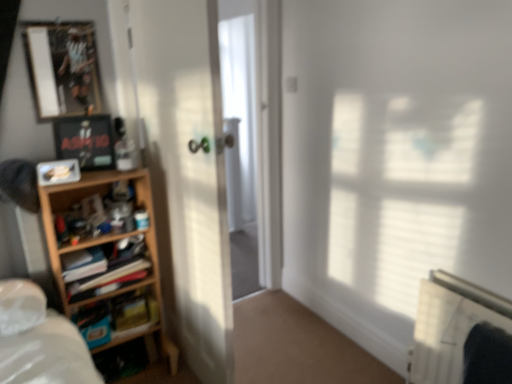
Question: From a real-world perspective, is metallic silver picture frame at upper left, the third picture frame positioned from the bottom, positioned over matte black picture frame at upper left, the second picture frame positioned from the bottom, based on gravity?

Choices:
 (A) no
 (B) yes

Answer: (B)

Question: Would you say metallic silver picture frame at upper left, the third picture frame positioned from the bottom, is outside matte black picture frame at upper left, the second picture frame positioned from the bottom?

Choices:
 (A) no
 (B) yes

Answer: (B)

Question: Does metallic silver picture frame at upper left, the first picture frame viewed from the top, appear on the right side of matte black picture frame at upper left, acting as the 2th picture frame starting from the top?

Choices:
 (A) no
 (B) yes

Answer: (A)

Question: Is matte black picture frame at upper left, the second picture frame positioned from the bottom, completely or partially inside metallic silver picture frame at upper left, the first picture frame viewed from the top?

Choices:
 (A) yes
 (B) no

Answer: (B)

Question: Is metallic silver picture frame at upper left, the first picture frame viewed from the top, turned away from matte black picture frame at upper left, acting as the 2th picture frame starting from the top?

Choices:
 (A) yes
 (B) no

Answer: (B)

Question: Is the position of metallic silver picture frame at upper left, the third picture frame positioned from the bottom, more distant than that of matte black picture frame at upper left, acting as the 2th picture frame starting from the top?

Choices:
 (A) no
 (B) yes

Answer: (A)

Question: Is the position of metallic silver picture frame at upper left, the first picture frame viewed from the top, more distant than that of matte plastic picture frame at left, which ranks as the third picture frame in top-to-bottom order?

Choices:
 (A) no
 (B) yes

Answer: (B)

Question: From a real-world perspective, is metallic silver picture frame at upper left, the third picture frame positioned from the bottom, beneath matte plastic picture frame at left, the 1th picture frame positioned from the bottom?

Choices:
 (A) yes
 (B) no

Answer: (B)

Question: Is metallic silver picture frame at upper left, the first picture frame viewed from the top, not close to matte plastic picture frame at left, which ranks as the third picture frame in top-to-bottom order?

Choices:
 (A) no
 (B) yes

Answer: (A)

Question: From the image's perspective, would you say metallic silver picture frame at upper left, the first picture frame viewed from the top, is positioned over matte plastic picture frame at left, which ranks as the third picture frame in top-to-bottom order?

Choices:
 (A) yes
 (B) no

Answer: (A)

Question: Can you confirm if metallic silver picture frame at upper left, the first picture frame viewed from the top, is positioned to the left of matte plastic picture frame at left, the 1th picture frame positioned from the bottom?

Choices:
 (A) yes
 (B) no

Answer: (A)

Question: Can you confirm if metallic silver picture frame at upper left, the third picture frame positioned from the bottom, is shorter than matte plastic picture frame at left, which ranks as the third picture frame in top-to-bottom order?

Choices:
 (A) no
 (B) yes

Answer: (A)

Question: Does hardcover book at left have a greater height compared to metallic silver picture frame at upper left, the third picture frame positioned from the bottom?

Choices:
 (A) no
 (B) yes

Answer: (A)